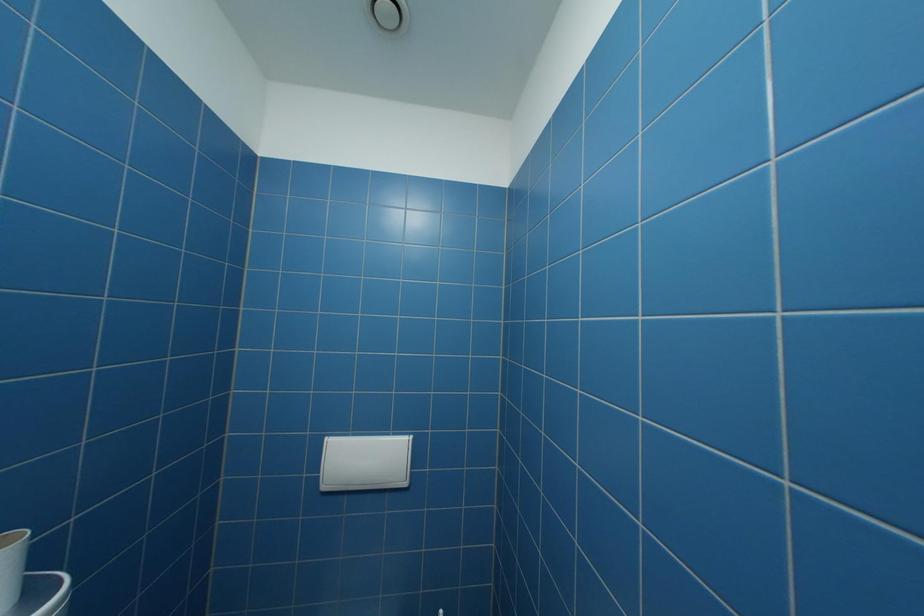
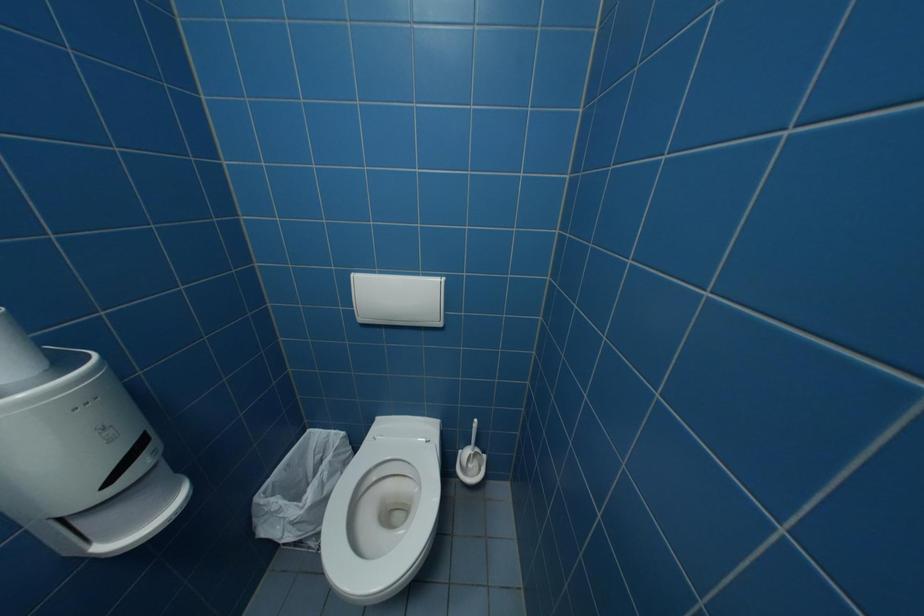
Question: How did the camera likely rotate?

Choices:
 (A) Left
 (B) Right
 (C) Up
 (D) Down

Answer: (D)